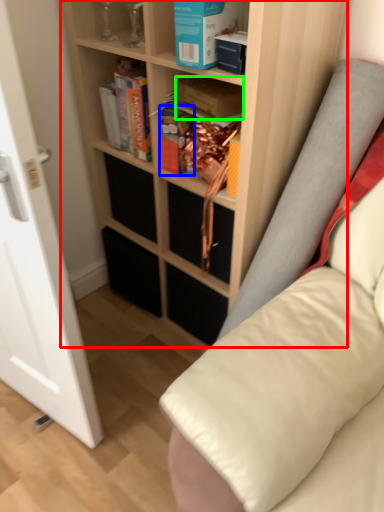
Question: Considering the real-world distances, which object is closest to shelf (highlighted by a red box)? paperback book (highlighted by a blue box) or paperback book (highlighted by a green box).

Choices:
 (A) paperback book
 (B) paperback book

Answer: (A)